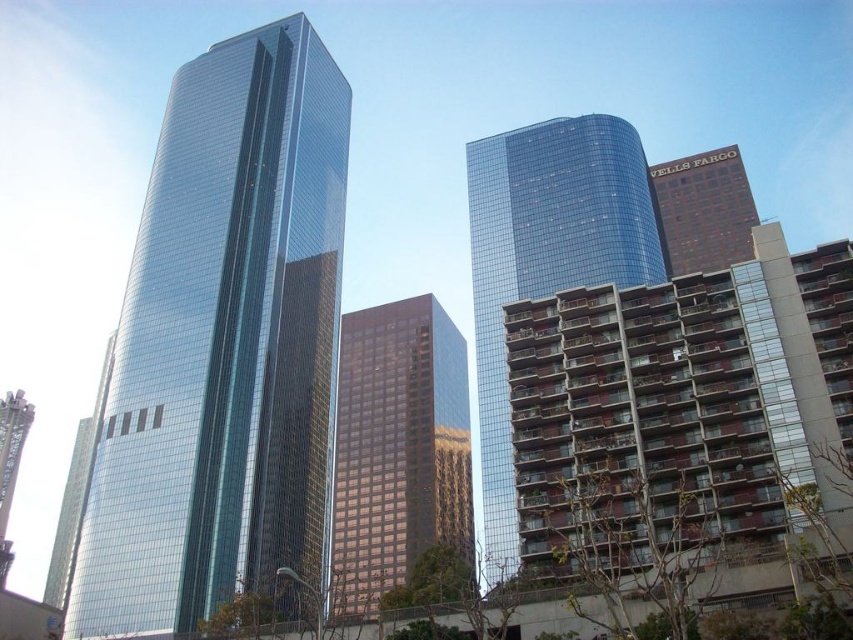
Question: Which point is farther from the camera taking this photo?

Choices:
 (A) (409, 300)
 (B) (651, 196)

Answer: (A)

Question: Is glossy glass skyscraper at center closer to the viewer compared to brick textured building at upper right?

Choices:
 (A) no
 (B) yes

Answer: (B)

Question: Is glossy glass skyscraper at center smaller than brick textured building at upper right?

Choices:
 (A) no
 (B) yes

Answer: (A)

Question: Where is glossy glass skyscraper at center located in relation to brown glass building at center in the image?

Choices:
 (A) below
 (B) above

Answer: (B)

Question: Based on their relative distances, which object is nearer to the glossy glass skyscraper at center?

Choices:
 (A) brown glass building at center
 (B) brick textured building at upper right

Answer: (A)

Question: Which object appears farthest from the camera in this image?

Choices:
 (A) brown glass building at center
 (B) glossy glass building at center
 (C) glossy glass skyscraper at center

Answer: (C)